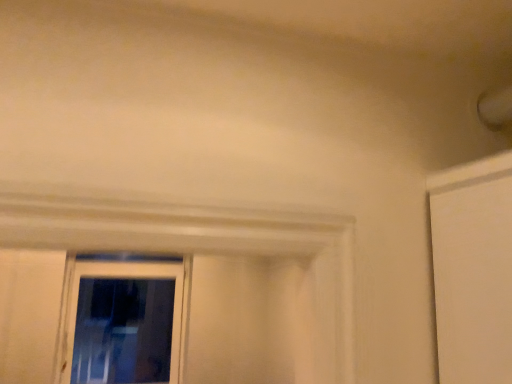
The image size is (512, 384). What do you see at coordinates (121, 321) in the screenshot?
I see `transparent glass window at lower left` at bounding box center [121, 321].

Where is `transparent glass window at lower left`? transparent glass window at lower left is located at coordinates (121, 321).

The image size is (512, 384). Find the location of `transparent glass window at lower left`. transparent glass window at lower left is located at coordinates (121, 321).